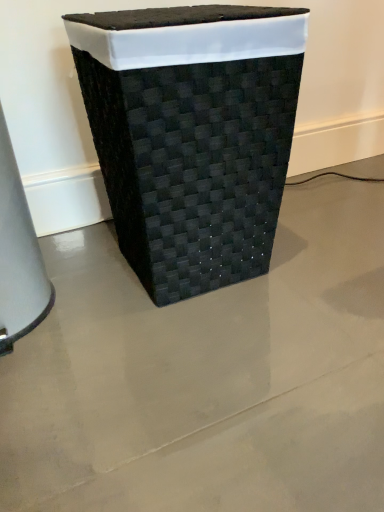
Question: Should I look upward or downward to see black woven basket at center?

Choices:
 (A) up
 (B) down

Answer: (A)